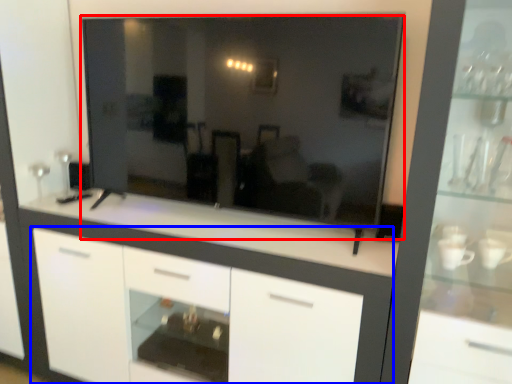
Question: Which of the following is the farthest to the observer, mirror (highlighted by a red box) or cabinetry (highlighted by a blue box)?

Choices:
 (A) mirror
 (B) cabinetry

Answer: (B)